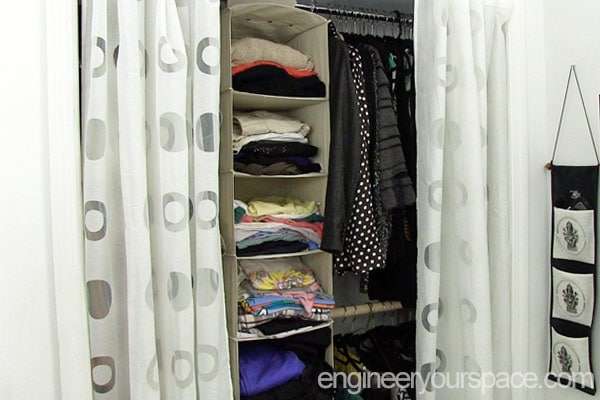
Find the location of `white curtains with clear circle shapes`. white curtains with clear circle shapes is located at coordinates (159, 191), (498, 154).